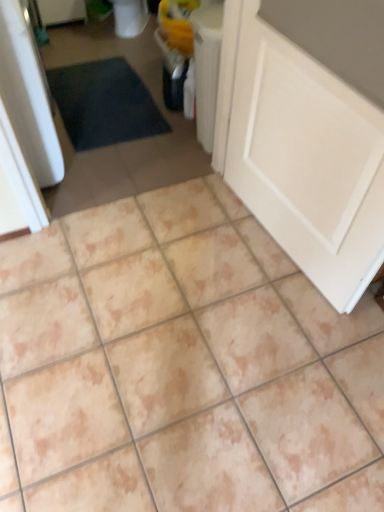
Question: Would you say white matte door at lower right contains beige ceramic tile at center?

Choices:
 (A) yes
 (B) no

Answer: (B)

Question: Is white matte door at lower right completely or partially outside of beige ceramic tile at center?

Choices:
 (A) no
 (B) yes

Answer: (B)

Question: From a real-world perspective, is white matte door at lower right on beige ceramic tile at center?

Choices:
 (A) no
 (B) yes

Answer: (B)

Question: Can you confirm if white matte door at lower right is bigger than beige ceramic tile at center?

Choices:
 (A) no
 (B) yes

Answer: (A)

Question: Considering the relative sizes of white matte door at lower right and beige ceramic tile at center in the image provided, is white matte door at lower right thinner than beige ceramic tile at center?

Choices:
 (A) no
 (B) yes

Answer: (B)

Question: Considering the relative positions of white matte door at lower right and beige ceramic tile at center in the image provided, is white matte door at lower right to the left of beige ceramic tile at center from the viewer's perspective?

Choices:
 (A) yes
 (B) no

Answer: (B)

Question: Is beige ceramic tile at center to the right of white matte door at lower right from the viewer's perspective?

Choices:
 (A) yes
 (B) no

Answer: (B)

Question: Is there a large distance between beige ceramic tile at center and white matte door at lower right?

Choices:
 (A) yes
 (B) no

Answer: (B)

Question: From a real-world perspective, is beige ceramic tile at center located beneath white matte door at lower right?

Choices:
 (A) no
 (B) yes

Answer: (B)

Question: From the image's perspective, does beige ceramic tile at center appear higher than white matte door at lower right?

Choices:
 (A) yes
 (B) no

Answer: (A)

Question: From the image's perspective, would you say beige ceramic tile at center is shown under white matte door at lower right?

Choices:
 (A) no
 (B) yes

Answer: (A)

Question: Is white matte door at lower right inside beige ceramic tile at center?

Choices:
 (A) no
 (B) yes

Answer: (A)

Question: From a real-world perspective, is white matte door at lower right physically located above or below beige ceramic tile at center?

Choices:
 (A) above
 (B) below

Answer: (A)